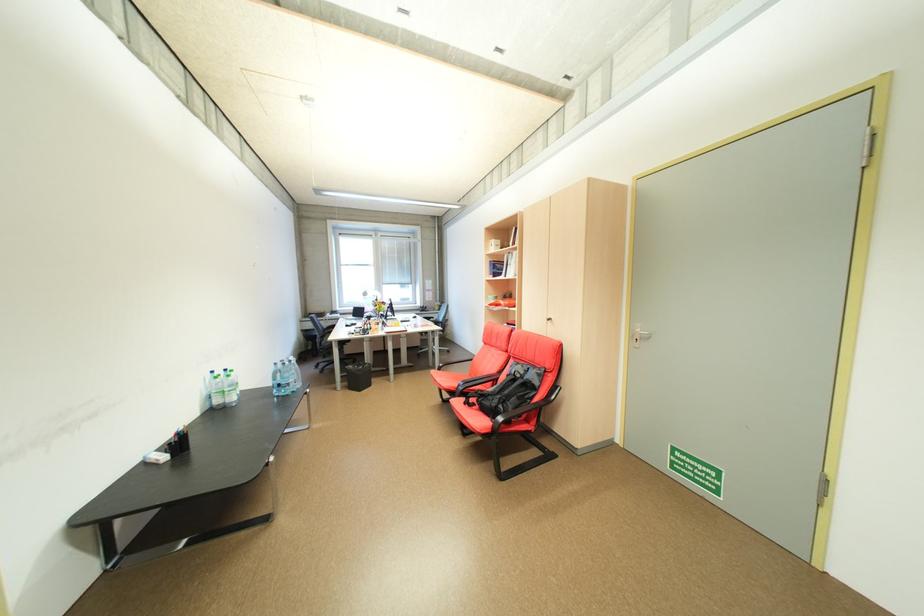
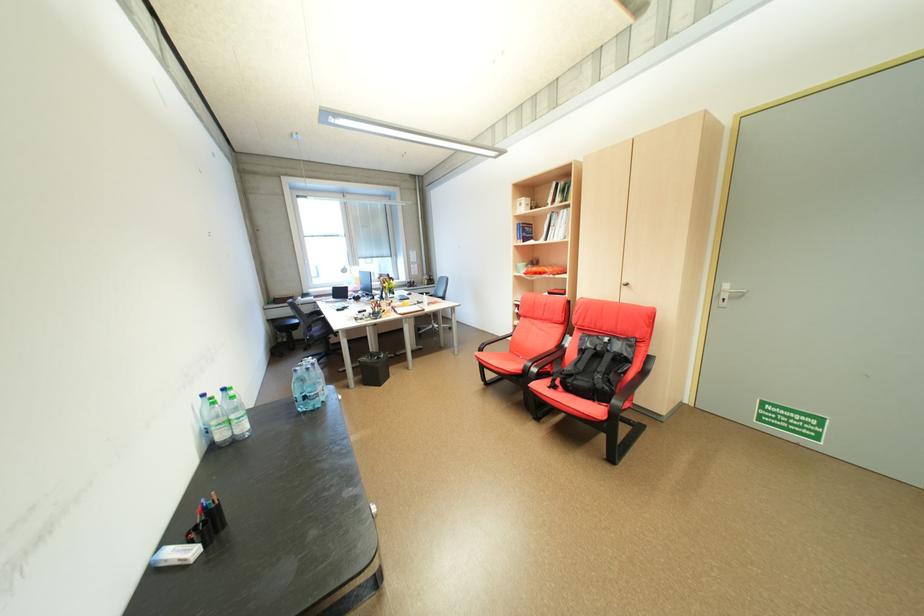
Find the pixel in the second image that matches (287,386) in the first image.

(313, 398)